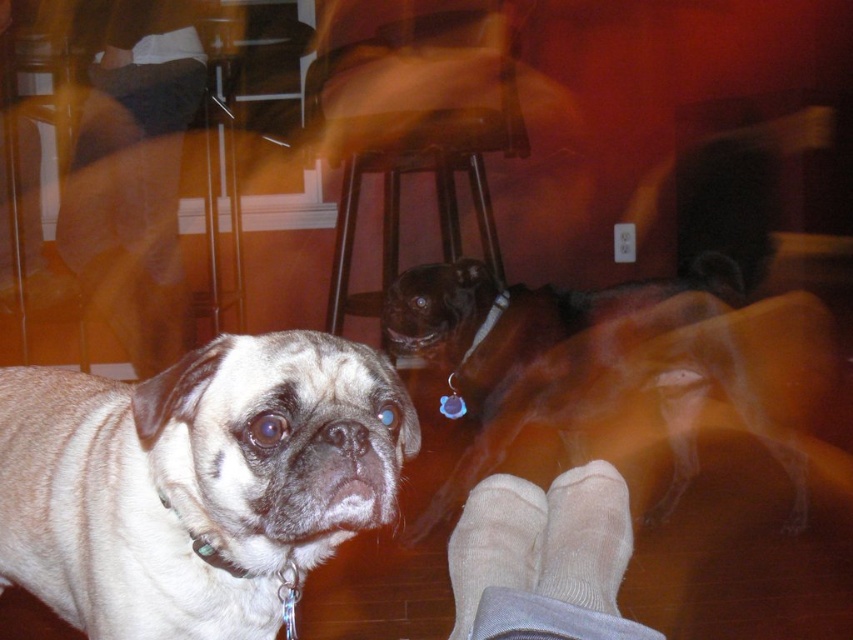
Can you confirm if light beige fur at center is bigger than brown shiny dog at center?

No, light beige fur at center is not bigger than brown shiny dog at center.

Who is positioned more to the left, light beige fur at center or brown shiny dog at center?

light beige fur at center

Is point (370, 506) positioned in front of point (741, 301)?

Yes, point (370, 506) is in front of point (741, 301).

Find the location of a particular element. light beige fur at center is located at coordinates (195, 481).

Does brown wooden stool at center come behind beige soft socks at lower center?

Yes, brown wooden stool at center is further from the viewer.

Does brown wooden stool at center appear on the right side of beige soft socks at lower center?

Incorrect, brown wooden stool at center is not on the right side of beige soft socks at lower center.

Between point (457, 148) and point (563, 593), which one is positioned in front?

Point (563, 593) is more forward.

Find the location of a particular element. The height and width of the screenshot is (640, 853). brown wooden stool at center is located at coordinates (398, 220).

Which is behind, point (537, 413) or point (525, 508)?

The point (537, 413) is more distant.

Can you confirm if brown shiny dog at center is positioned to the right of white soft sock at lower center?

Correct, you'll find brown shiny dog at center to the right of white soft sock at lower center.

Which is in front, point (631, 298) or point (492, 528)?

Point (492, 528) is in front.

Identify the location of brown shiny dog at center. The width and height of the screenshot is (853, 640). (x=584, y=356).